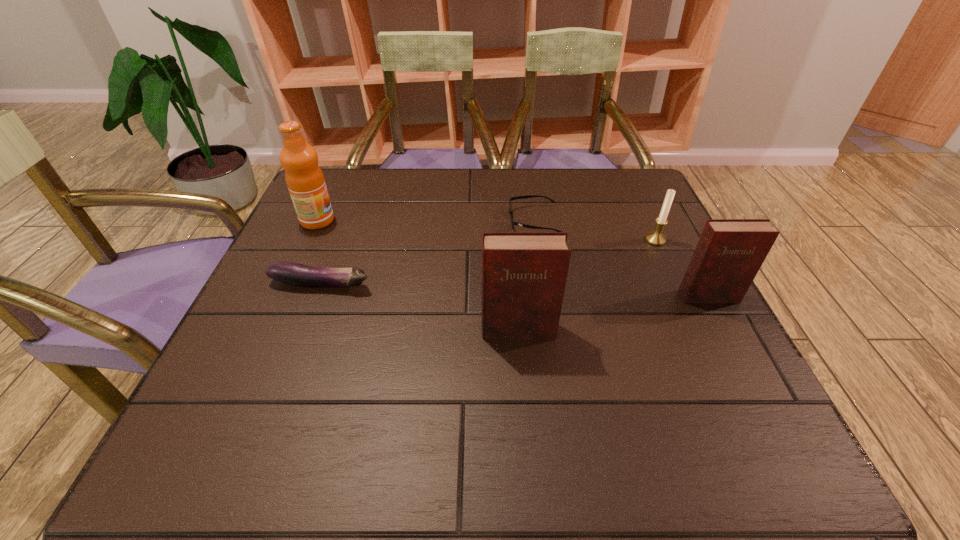
The width and height of the screenshot is (960, 540). In order to click on vacant spot to place a diary on the left in this screenshot , I will do `click(296, 369)`.